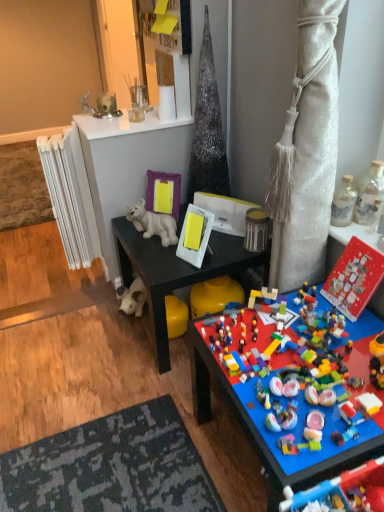
You are a GUI agent. You are given a task and a screenshot of the screen. Output one action in this format:
    pyautogui.click(x=<x>, y=<y>)
    Task: Click on the free spot in front of metallic silver candlestick at upper center, the first toy from the top
    The image size is (384, 512).
    Given the screenshot: What is the action you would take?
    pyautogui.click(x=109, y=121)